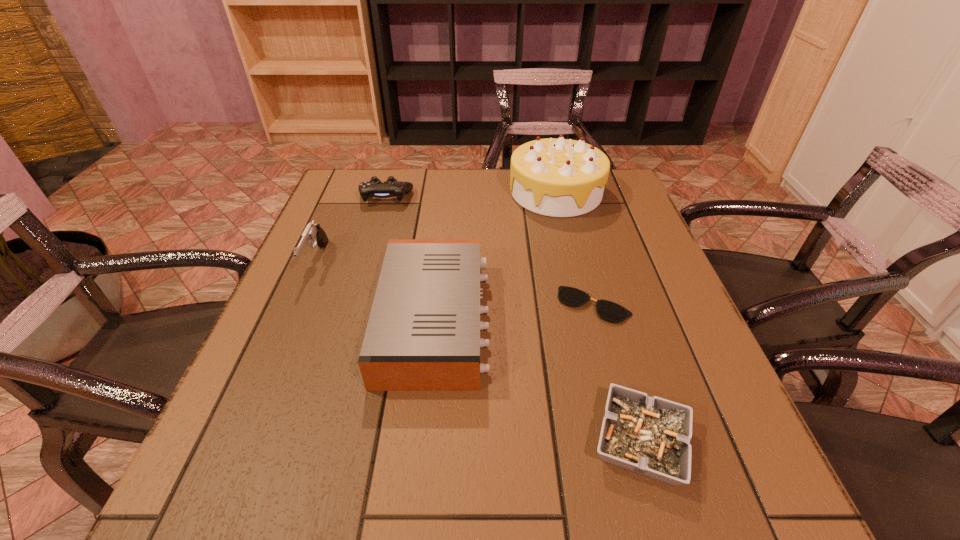
Find the location of a particular element. The image size is (960, 540). vacant region located on the front of the fourth tallest object is located at coordinates (358, 290).

Where is `vacant space situated on the left of the nearest object`? Image resolution: width=960 pixels, height=540 pixels. vacant space situated on the left of the nearest object is located at coordinates (346, 442).

I want to click on vacant position located 0.150m on the front of the spectacles, so click(x=616, y=388).

Image resolution: width=960 pixels, height=540 pixels. I want to click on birthday cake present at the far edge, so click(560, 177).

Where is `control that is at the far edge`? Image resolution: width=960 pixels, height=540 pixels. control that is at the far edge is located at coordinates (374, 188).

Where is `object that is positioned at the near edge`? The height and width of the screenshot is (540, 960). object that is positioned at the near edge is located at coordinates (651, 436).

The height and width of the screenshot is (540, 960). I want to click on gun present at the left edge, so 313,233.

Where is `control situated at the left edge`? The image size is (960, 540). control situated at the left edge is located at coordinates (374, 188).

This screenshot has width=960, height=540. I want to click on birthday cake situated at the right edge, so click(x=560, y=177).

I want to click on ashtray at the right edge, so click(x=651, y=436).